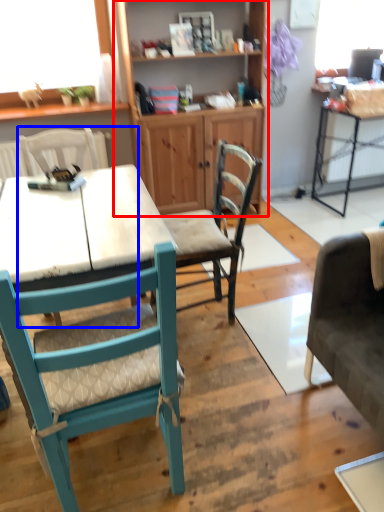
Question: Which object appears closest to the camera in this image, cabinetry (highlighted by a red box) or chair (highlighted by a blue box)?

Choices:
 (A) cabinetry
 (B) chair

Answer: (B)